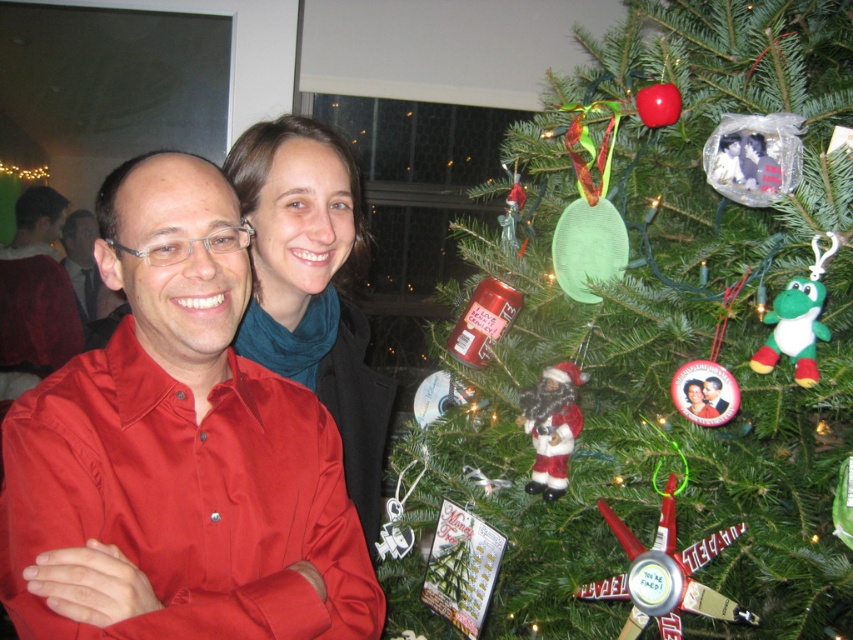
Question: Based on their relative distances, which object is nearer to the green matte christmas tree at center?

Choices:
 (A) satin red shirt at left
 (B) blue scarf at center

Answer: (B)

Question: Does green matte christmas tree at center appear on the left side of satin red shirt at left?

Choices:
 (A) no
 (B) yes

Answer: (A)

Question: Does green matte christmas tree at center have a greater width compared to blue scarf at center?

Choices:
 (A) yes
 (B) no

Answer: (A)

Question: Which point is closer to the camera?

Choices:
 (A) (671, 403)
 (B) (276, 330)
 (C) (321, 548)

Answer: (C)

Question: Is green matte christmas tree at center wider than blue scarf at center?

Choices:
 (A) yes
 (B) no

Answer: (A)

Question: Estimate the real-world distances between objects in this image. Which object is closer to the satin red shirt at left?

Choices:
 (A) blue scarf at center
 (B) green matte christmas tree at center

Answer: (A)